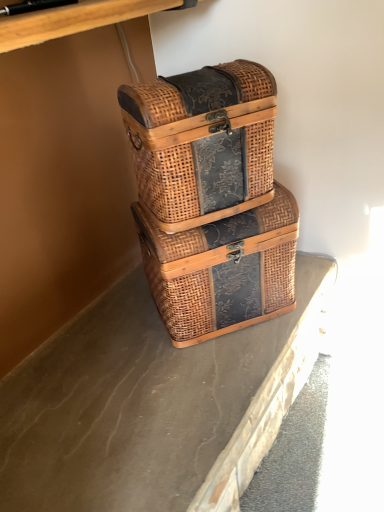
Describe the element at coordinates (222, 269) in the screenshot. Image resolution: width=384 pixels, height=512 pixels. I see `woven brown picnic basket at center, acting as the 1th picnic basket starting from the bottom` at that location.

The height and width of the screenshot is (512, 384). Identify the location of woven brown picnic basket at center, acting as the 1th picnic basket starting from the bottom. (222, 269).

This screenshot has width=384, height=512. I want to click on woven wood picnic basket at center, which is the second picnic basket in bottom-to-top order, so click(202, 143).

Which is correct: woven brown picnic basket at center, acting as the 1th picnic basket starting from the bottom, is inside brown textured concrete at center, or outside of it?

woven brown picnic basket at center, acting as the 1th picnic basket starting from the bottom, is spatially situated outside brown textured concrete at center.

Based on the photo, is woven brown picnic basket at center, acting as the 1th picnic basket starting from the bottom, in contact with brown textured concrete at center?

woven brown picnic basket at center, acting as the 1th picnic basket starting from the bottom, and brown textured concrete at center are not in contact.

In terms of width, does woven brown picnic basket at center, which is the second picnic basket in top-to-bottom order, look wider or thinner when compared to brown textured concrete at center?

woven brown picnic basket at center, which is the second picnic basket in top-to-bottom order, is thinner than brown textured concrete at center.

From a real-world perspective, which is physically below, woven brown picnic basket at center, which is the second picnic basket in top-to-bottom order, or brown textured concrete at center?

brown textured concrete at center.

From the image's perspective, which one is positioned lower, woven wood picnic basket at center, arranged as the first picnic basket when viewed from the top, or woven brown picnic basket at center, acting as the 1th picnic basket starting from the bottom?

From the image's view, woven brown picnic basket at center, acting as the 1th picnic basket starting from the bottom, is below.

Locate an element on the screen. The image size is (384, 512). picnic basket behind the woven wood picnic basket at center, which is the second picnic basket in bottom-to-top order is located at coordinates (222, 269).

Who is shorter, woven wood picnic basket at center, arranged as the first picnic basket when viewed from the top, or woven brown picnic basket at center, which is the second picnic basket in top-to-bottom order?

With less height is woven wood picnic basket at center, arranged as the first picnic basket when viewed from the top.

From the image's perspective, which one is positioned higher, woven brown picnic basket at center, acting as the 1th picnic basket starting from the bottom, or woven wood picnic basket at center, arranged as the first picnic basket when viewed from the top?

woven wood picnic basket at center, arranged as the first picnic basket when viewed from the top, from the image's perspective.

How much distance is there between woven brown picnic basket at center, which is the second picnic basket in top-to-bottom order, and woven wood picnic basket at center, which is the second picnic basket in bottom-to-top order?

They are 5.40 inches apart.

Is point (256, 256) behind point (211, 198)?

Yes, it is.

In terms of width, does woven brown picnic basket at center, acting as the 1th picnic basket starting from the bottom, look wider or thinner when compared to woven wood picnic basket at center, which is the second picnic basket in bottom-to-top order?

Clearly, woven brown picnic basket at center, acting as the 1th picnic basket starting from the bottom, has more width compared to woven wood picnic basket at center, which is the second picnic basket in bottom-to-top order.

Is woven wood picnic basket at center, which is the second picnic basket in bottom-to-top order, positioned with its back to brown textured concrete at center?

No.

Between woven wood picnic basket at center, arranged as the first picnic basket when viewed from the top, and brown textured concrete at center, which one has smaller size?

With smaller size is brown textured concrete at center.

Is woven wood picnic basket at center, arranged as the first picnic basket when viewed from the top, in contact with brown textured concrete at center?

No.

Where is `concrete below the woven wood picnic basket at center, which is the second picnic basket in bottom-to-top order (from the image's perspective)`? concrete below the woven wood picnic basket at center, which is the second picnic basket in bottom-to-top order (from the image's perspective) is located at coordinates (151, 406).

Is brown textured concrete at center taller or shorter than woven wood picnic basket at center, arranged as the first picnic basket when viewed from the top?

Clearly, brown textured concrete at center is shorter compared to woven wood picnic basket at center, arranged as the first picnic basket when viewed from the top.

Between brown textured concrete at center and woven wood picnic basket at center, which is the second picnic basket in bottom-to-top order, which one appears on the left side from the viewer's perspective?

brown textured concrete at center.

Does point (36, 464) come farther from viewer compared to point (171, 336)?

No, it is not.

From the picture: Does brown textured concrete at center have a greater width compared to woven brown picnic basket at center, acting as the 1th picnic basket starting from the bottom?

Correct, the width of brown textured concrete at center exceeds that of woven brown picnic basket at center, acting as the 1th picnic basket starting from the bottom.

From the image's perspective, who appears lower, brown textured concrete at center or woven brown picnic basket at center, which is the second picnic basket in top-to-bottom order?

brown textured concrete at center appears lower in the image.

I want to click on concrete in front of the woven brown picnic basket at center, which is the second picnic basket in top-to-bottom order, so click(x=151, y=406).

Where is `picnic basket that is below the woven wood picnic basket at center, arranged as the first picnic basket when viewed from the top (from the image's perspective)`? Image resolution: width=384 pixels, height=512 pixels. picnic basket that is below the woven wood picnic basket at center, arranged as the first picnic basket when viewed from the top (from the image's perspective) is located at coordinates (222, 269).

Which object lies nearer to the anchor point woven wood picnic basket at center, arranged as the first picnic basket when viewed from the top, brown textured concrete at center or woven brown picnic basket at center, acting as the 1th picnic basket starting from the bottom?

woven brown picnic basket at center, acting as the 1th picnic basket starting from the bottom, is positioned closer to the anchor woven wood picnic basket at center, arranged as the first picnic basket when viewed from the top.

Considering their positions, is woven brown picnic basket at center, which is the second picnic basket in top-to-bottom order, positioned further to woven wood picnic basket at center, arranged as the first picnic basket when viewed from the top, than brown textured concrete at center?

brown textured concrete at center.

From the image, which object appears to be farther from brown textured concrete at center, woven brown picnic basket at center, which is the second picnic basket in top-to-bottom order, or woven wood picnic basket at center, which is the second picnic basket in bottom-to-top order?

Based on the image, woven wood picnic basket at center, which is the second picnic basket in bottom-to-top order, appears to be further to brown textured concrete at center.

Looking at the image, which one is located closer to brown textured concrete at center, woven wood picnic basket at center, which is the second picnic basket in bottom-to-top order, or woven brown picnic basket at center, which is the second picnic basket in top-to-bottom order?

woven brown picnic basket at center, which is the second picnic basket in top-to-bottom order, lies closer to brown textured concrete at center than the other object.

From the picture: Based on their spatial positions, is woven wood picnic basket at center, arranged as the first picnic basket when viewed from the top, or brown textured concrete at center closer to woven brown picnic basket at center, acting as the 1th picnic basket starting from the bottom?

woven wood picnic basket at center, arranged as the first picnic basket when viewed from the top, is positioned closer to the anchor woven brown picnic basket at center, acting as the 1th picnic basket starting from the bottom.

From the image, which object appears to be nearer to woven brown picnic basket at center, acting as the 1th picnic basket starting from the bottom, brown textured concrete at center or woven wood picnic basket at center, which is the second picnic basket in bottom-to-top order?

woven wood picnic basket at center, which is the second picnic basket in bottom-to-top order, is closer to woven brown picnic basket at center, acting as the 1th picnic basket starting from the bottom.

The image size is (384, 512). In order to click on picnic basket between woven wood picnic basket at center, which is the second picnic basket in bottom-to-top order, and brown textured concrete at center from top to bottom in this screenshot , I will do `click(222, 269)`.